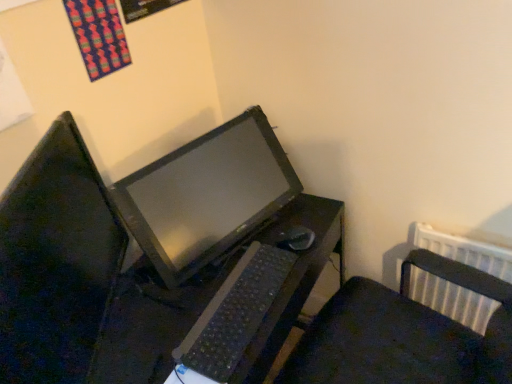
The image size is (512, 384). What are the coordinates of `vacant region above black plastic desk at center (from a real-world perspective)` in the screenshot? It's located at (204, 285).